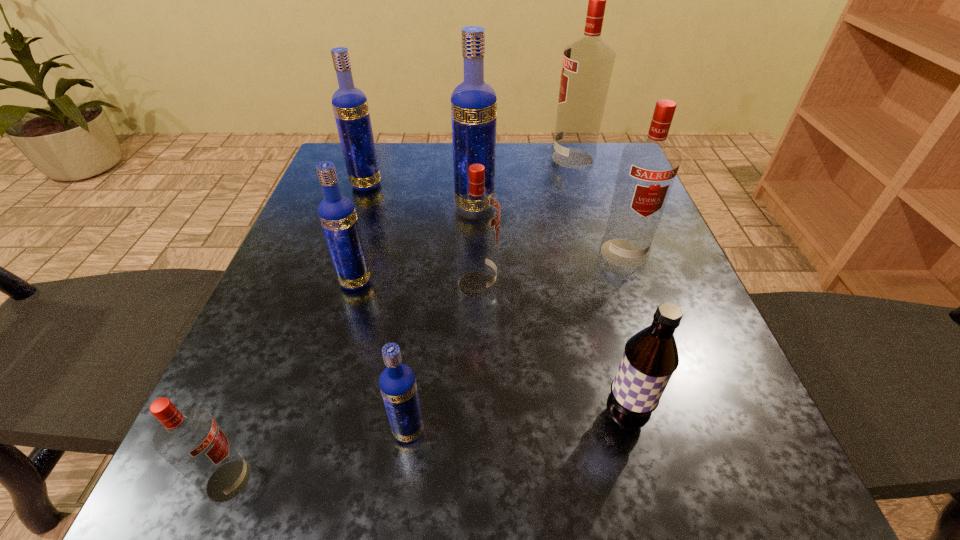
Find the location of a particular element. The height and width of the screenshot is (540, 960). vodka that is the sixth closest one to the third red vodka from right to left is located at coordinates (189, 439).

Identify which red vodka is located as the third nearest to the nearest vodka. Please provide its 2D coordinates. Your answer should be formatted as a tuple, i.e. [(x, y)], where the tuple contains the x and y coordinates of a point satisfying the conditions above.

[(587, 65)]

Locate which red vodka ranks in proximity to the second red vodka from left to right. Please provide its 2D coordinates. Your answer should be formatted as a tuple, i.e. [(x, y)], where the tuple contains the x and y coordinates of a point satisfying the conditions above.

[(648, 167)]

At what (x,y) coordinates should I click in order to perform the action: click on blue vodka object that ranks as the closest to the second farthest red vodka. Please return your answer as a coordinate pair (x, y). The image size is (960, 540). Looking at the image, I should click on (473, 102).

This screenshot has height=540, width=960. I want to click on blue vodka identified as the third closest to the second biggest blue vodka, so click(x=397, y=382).

The width and height of the screenshot is (960, 540). Identify the location of free location that satisfies the following two spatial constraints: 1. on the front side of the brown root beer; 2. on the front label of the nearest red vodka. (640, 481).